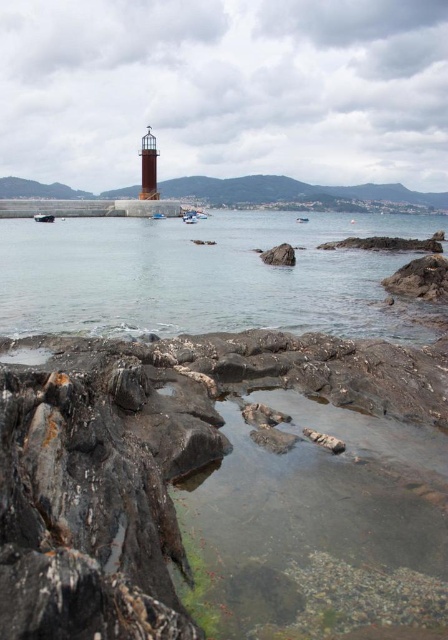
Who is lower down, rough textured rock at center or metallic gray boat at lower left?

rough textured rock at center is lower down.

Can you confirm if rough textured rock at center is taller than metallic gray boat at lower left?

Incorrect, rough textured rock at center's height is not larger of metallic gray boat at lower left's.

Is point (271, 259) positioned before point (43, 218)?

Yes, point (271, 259) is closer to viewer.

You are a GUI agent. You are given a task and a screenshot of the screen. Output one action in this format:
    pyautogui.click(x=<x>, y=<y>)
    Task: Click on the rough textured rock at center
    The width and height of the screenshot is (448, 640).
    Given the screenshot: What is the action you would take?
    pyautogui.click(x=279, y=256)

Does clear water at center have a lesser height compared to rough textured rock at center?

Incorrect, clear water at center's height does not fall short of rough textured rock at center's.

Which of these two, clear water at center or rough textured rock at center, stands taller?

clear water at center

Is point (171, 278) closer to viewer compared to point (291, 264)?

Yes, point (171, 278) is in front of point (291, 264).

I want to click on clear water at center, so click(x=205, y=275).

Between rough textured rock at center and white plastic boat at center, which one has more height?

white plastic boat at center

Where is `rough textured rock at center`? rough textured rock at center is located at coordinates (279, 256).

The width and height of the screenshot is (448, 640). I want to click on rough textured rock at center, so click(279, 256).